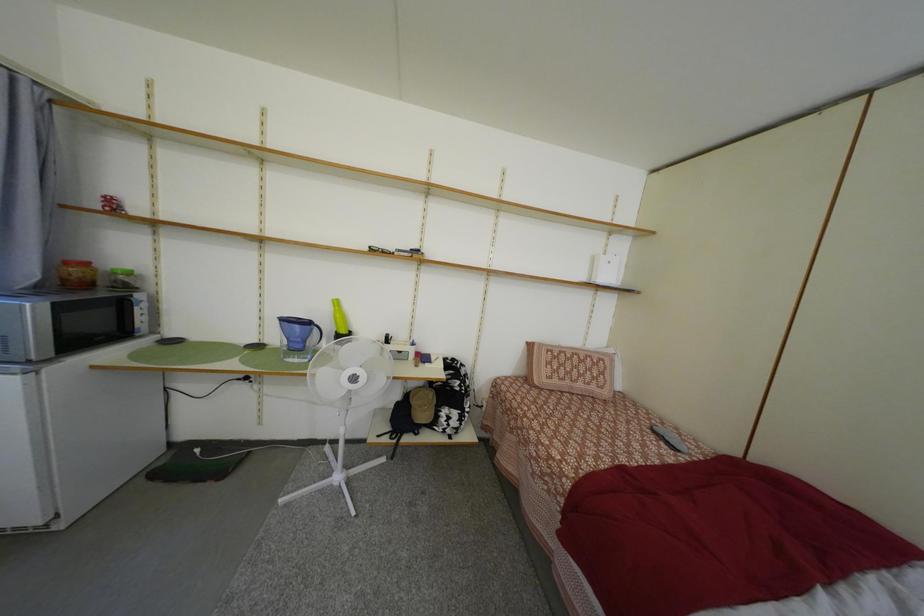
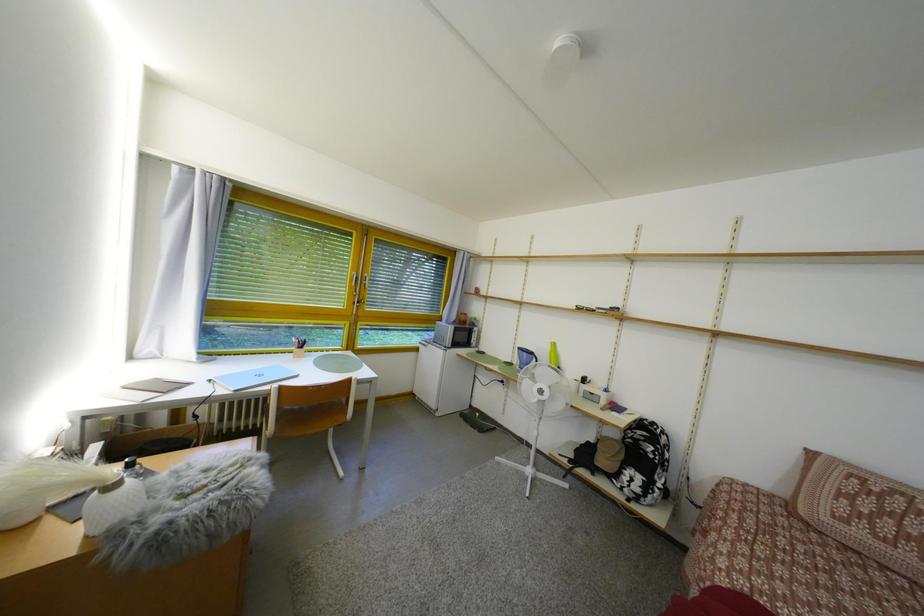
Question: The images are taken continuously from a first-person perspective. In which direction is your viewpoint rotating?

Choices:
 (A) Left
 (B) Right
 (C) Up
 (D) Down

Answer: (A)